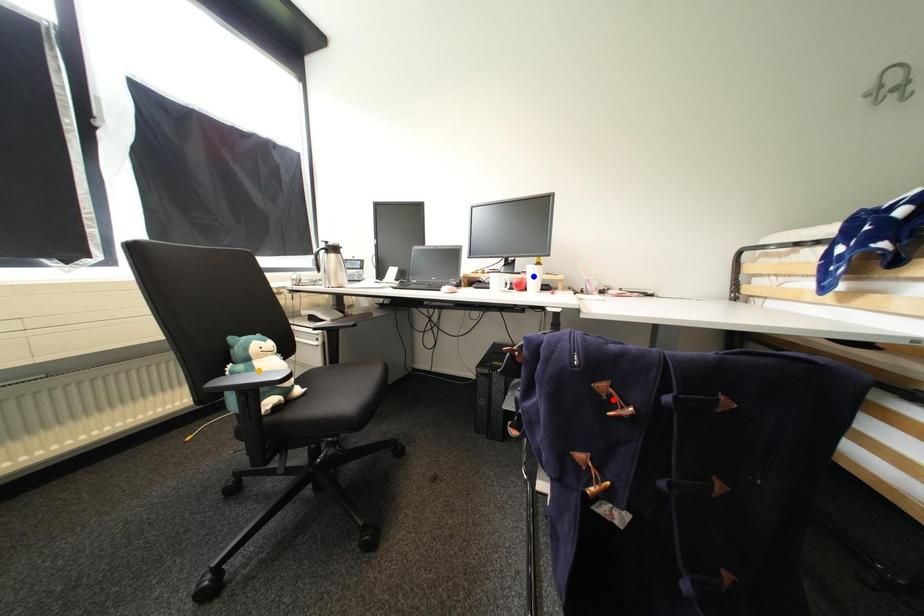
Order these from farthest to nearest:
orange point, blue point, red point

blue point < orange point < red point